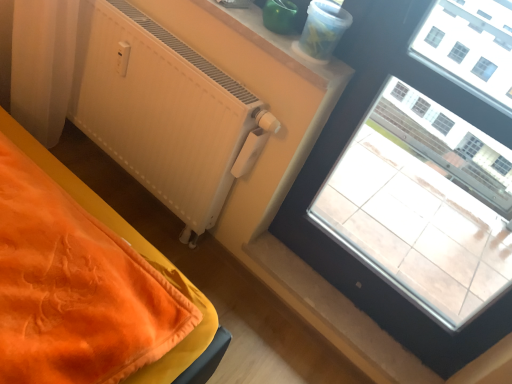
You are a GUI agent. You are given a task and a screenshot of the screen. Output one action in this format:
    pyautogui.click(x=<x>, y=<y>)
    Task: Click on the free space above smooth plastic container at upper center (from a real-world perspective)
    
    Given the screenshot: What is the action you would take?
    pyautogui.click(x=284, y=32)